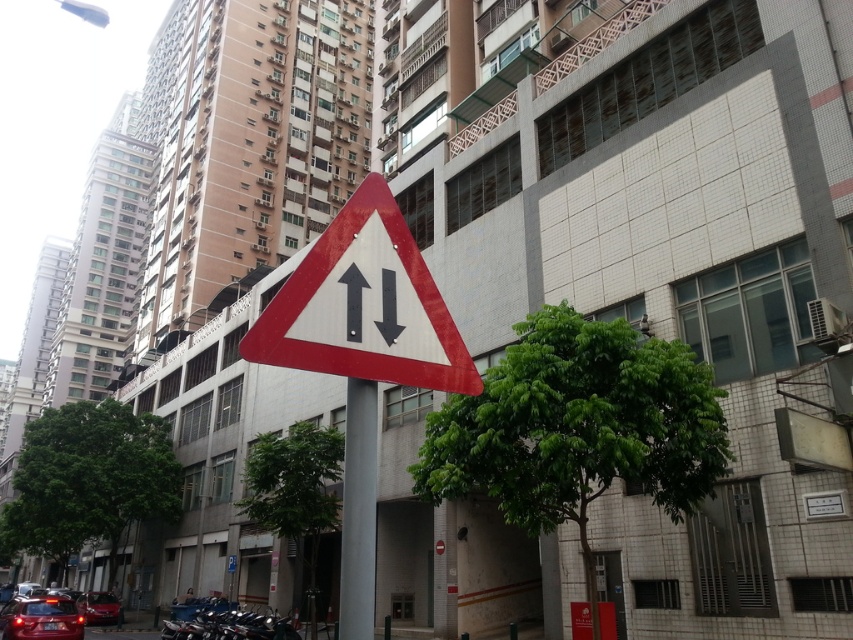
You are standing at the camera position in this urban street scene. There is a point marked at coordinates point [144,468]. Can you walk directly to this point from your current position?

The point [144,468] is 29.34 meters away from the camera, so yes, you can walk directly to it as there are no obstacles mentioned in the scene description between your position and the point.

You are a pedestrian standing on the sidewalk and see the green leafy tree at lower left and the black glossy arrow at center. Which object is closer to you?

The green leafy tree at lower left is closer to you because the black glossy arrow at center is behind it.

You are a pedestrian standing on the sidewalk and see the green leafy tree at lower left and the black glossy arrow at center. Which object is closer to you?

The green leafy tree at lower left is closer to you because it is positioned under the black glossy arrow at center, indicating it is in front of the arrow.